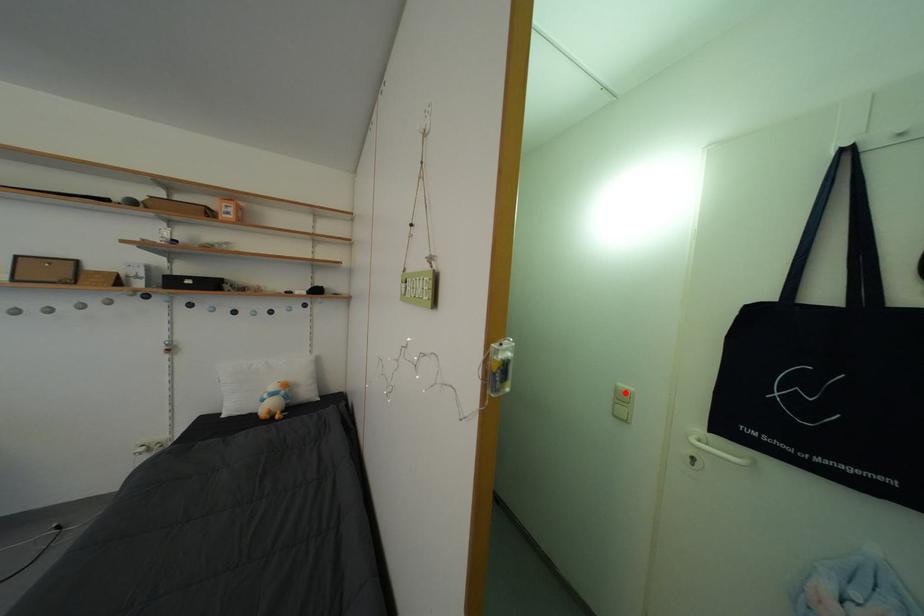
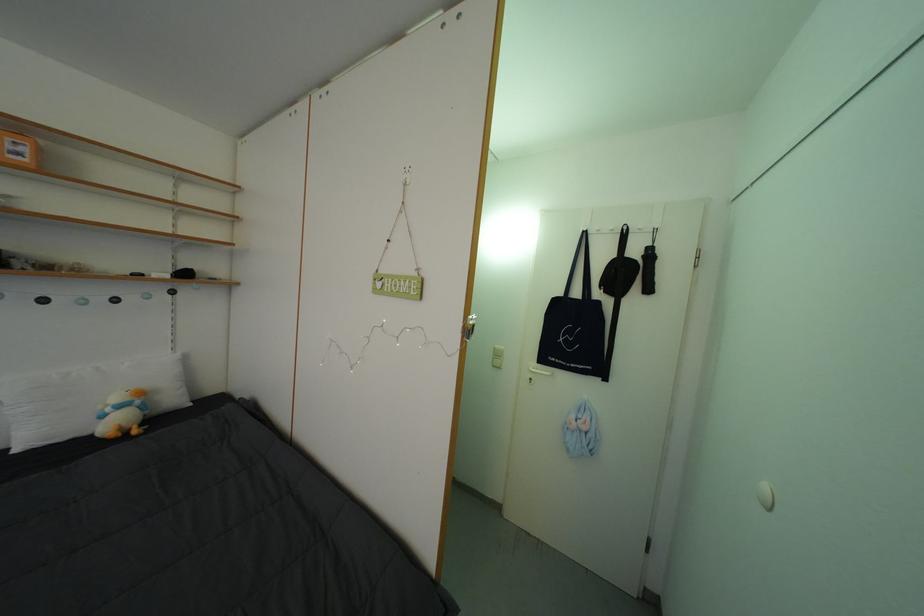
Where in the second image is the point corresponding to the highlighted location from the first image?

(504, 354)